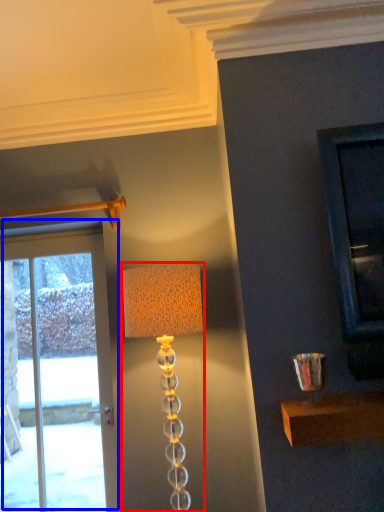
Question: Among these objects, which one is farthest to the camera, lamp (highlighted by a red box) or door (highlighted by a blue box)?

Choices:
 (A) lamp
 (B) door

Answer: (B)